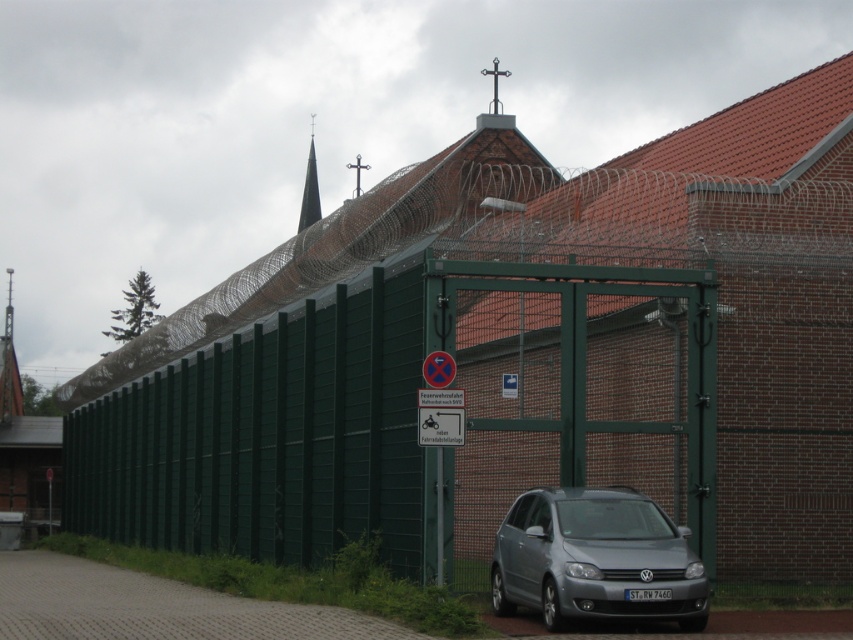
Measure the distance from satin silver car at lower center to smooth gray steeple at upper center.

satin silver car at lower center is 45.01 meters from smooth gray steeple at upper center.

Is satin silver car at lower center wider than smooth gray steeple at upper center?

No.

Locate an element on the screen. satin silver car at lower center is located at coordinates (595, 557).